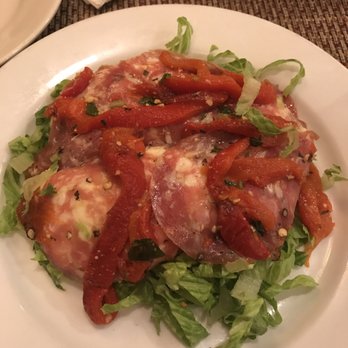
The image size is (348, 348). What are the coordinates of `napkin` in the screenshot? It's located at click(x=100, y=5).